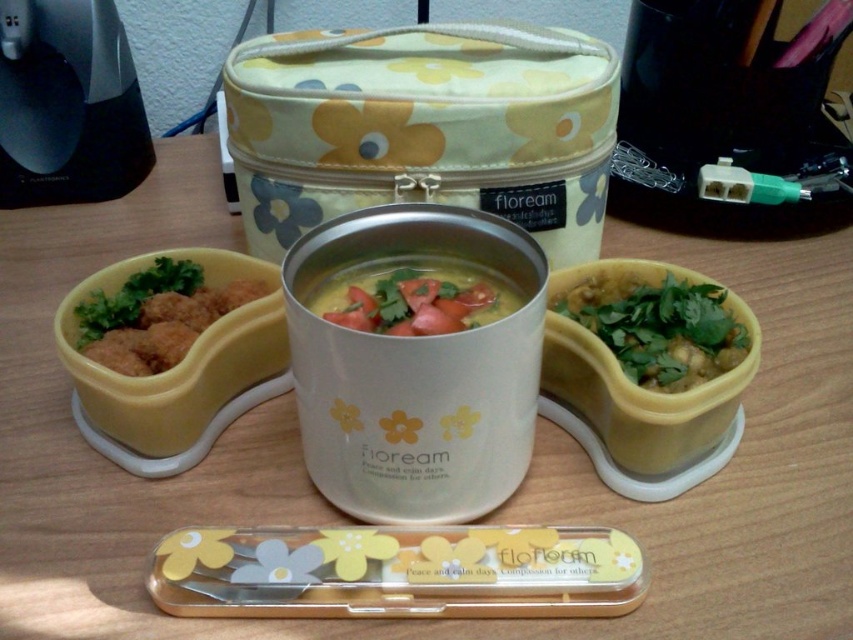
You are a food critic evaluating the bento meal. You notice the green leafy garnish at center and the yellow matte soup at center. Which of these two items is taller?

The green leafy garnish at center is taller than the yellow matte soup at center.

You are a food critic evaluating the presentation of the bento meal. Which object among the green leafy garnish at center and the yellow matte soup at center is bigger in size?

The green leafy garnish at center is larger in size than the yellow matte soup at center.

You are holding a spoon and want to reach the point at coordinates (619, 289) on the bento box. If your hand is currently 30 inches away from the bento box, can you comfortably reach that point without moving your hand closer?

The point at coordinates (619, 289) is 28.79 inches away from the viewer. Since your hand is currently 30 inches away, it is slightly farther than the required distance. You would need to move your hand about 1.21 inches closer to comfortably reach the point.